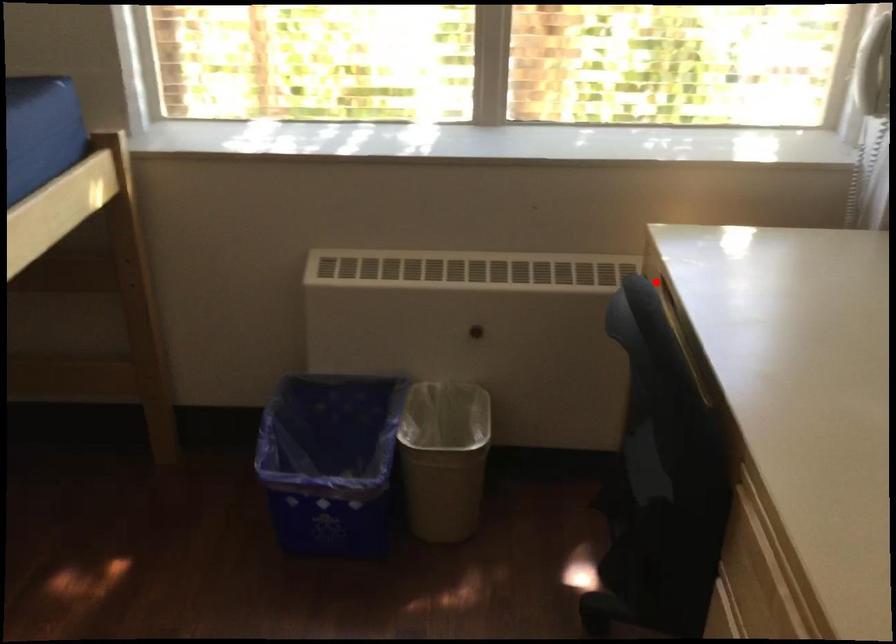
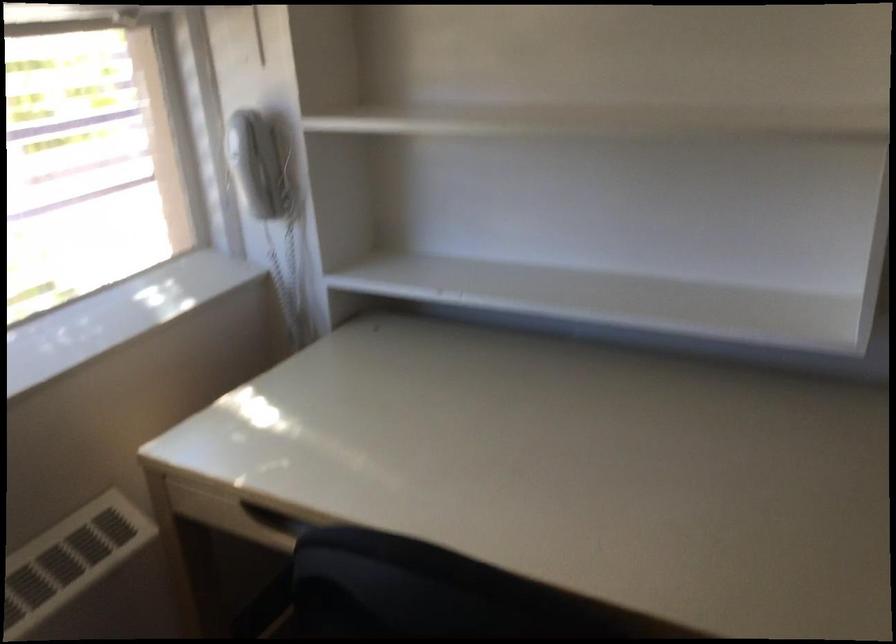
Question: I am providing you with two images of the same scene from different viewpoints. Given a red point in image1, look at the same physical point in image2. Is it:

Choices:
 (A) Closer to the viewpoint
 (B) Farther from the viewpoint

Answer: (A)